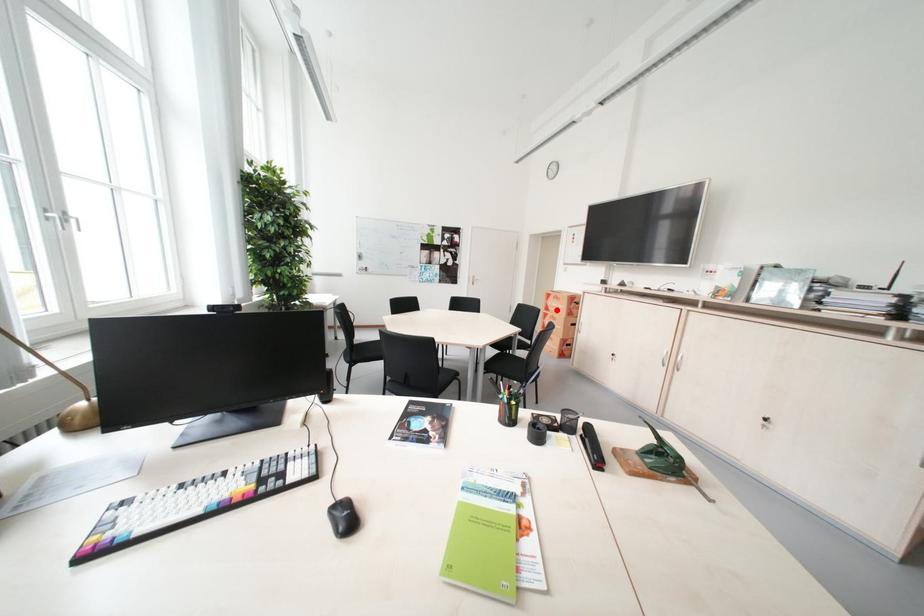
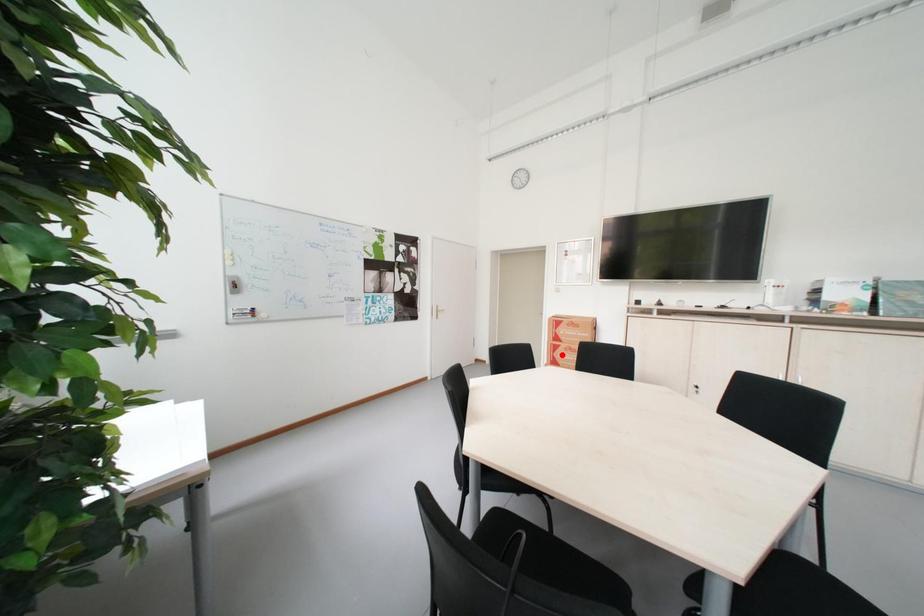
I am providing you with two images of the same scene from different viewpoints. A red point is marked on the first image and another point is marked on the second image. Do the highlighted points in image1 and image2 indicate the same real-world spot?

No